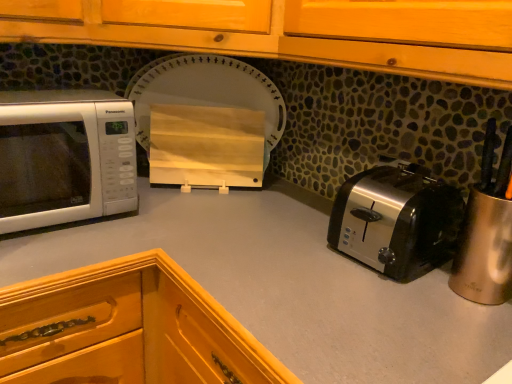
Question: From a real-world perspective, relative to smooth gray countertop at center, is satin silver toaster at lower right vertically above or below?

Choices:
 (A) below
 (B) above

Answer: (B)

Question: Relative to smooth gray countertop at center, is satin silver toaster at lower right in front or behind?

Choices:
 (A) behind
 (B) front

Answer: (A)

Question: Considering the real-world distances, which object is closest to the wooden cutting board at center?

Choices:
 (A) satin silver toaster at lower right
 (B) white glossy microwave at left
 (C) smooth gray countertop at center

Answer: (B)

Question: Which of these objects is positioned farthest from the satin silver toaster at lower right?

Choices:
 (A) white glossy microwave at left
 (B) wooden cutting board at center
 (C) smooth gray countertop at center

Answer: (A)